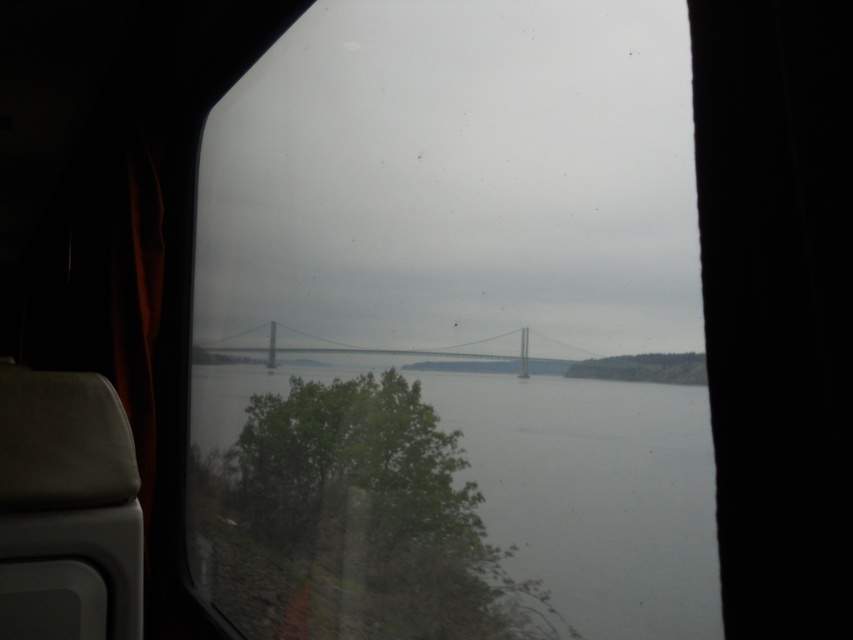
From the picture: Does gray water at center appear over gray metallic bridge at center?

Actually, gray water at center is below gray metallic bridge at center.

What do you see at coordinates (451, 504) in the screenshot? I see `gray water at center` at bounding box center [451, 504].

Who is more distant from viewer, (291,579) or (251,346)?

The point (251,346) is more distant.

You are a GUI agent. You are given a task and a screenshot of the screen. Output one action in this format:
    pyautogui.click(x=<x>, y=<y>)
    Task: Click on the gray water at center
    This screenshot has height=640, width=853.
    Given the screenshot: What is the action you would take?
    pyautogui.click(x=451, y=504)

Does transparent glass window at center come behind gray metallic bridge at center?

No, transparent glass window at center is closer to the viewer.

Can you confirm if transparent glass window at center is shorter than gray metallic bridge at center?

No, transparent glass window at center is not shorter than gray metallic bridge at center.

Which is behind, point (303, 65) or point (477, 355)?

Positioned behind is point (303, 65).

The image size is (853, 640). What are the coordinates of `transparent glass window at center` in the screenshot? It's located at (454, 330).

The width and height of the screenshot is (853, 640). What are the coordinates of `transparent glass window at center` in the screenshot? It's located at (454, 330).

Where is `transparent glass window at center`? This screenshot has height=640, width=853. transparent glass window at center is located at coordinates (454, 330).